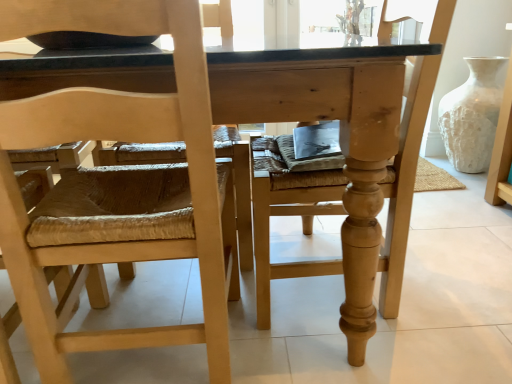
Question: Which direction should I rotate to look at natural wood chair at center, the first chair when ordered from right to left?

Choices:
 (A) right
 (B) left

Answer: (A)

Question: Considering the relative positions of white textured vase at right and natural wood chair at left, placed as the first chair when sorted from left to right, in the image provided, is white textured vase at right in front of natural wood chair at left, placed as the first chair when sorted from left to right,?

Choices:
 (A) no
 (B) yes

Answer: (A)

Question: From the image's perspective, would you say white textured vase at right is shown under natural wood chair at left, placed as the first chair when sorted from left to right?

Choices:
 (A) yes
 (B) no

Answer: (B)

Question: Considering the relative sizes of white textured vase at right and natural wood chair at left, placed as the first chair when sorted from left to right, in the image provided, is white textured vase at right thinner than natural wood chair at left, placed as the first chair when sorted from left to right,?

Choices:
 (A) no
 (B) yes

Answer: (B)

Question: Can you confirm if white textured vase at right is positioned to the right of natural wood chair at left, placed as the first chair when sorted from left to right?

Choices:
 (A) yes
 (B) no

Answer: (A)

Question: Considering the relative positions of white textured vase at right and natural wood chair at left, the second chair viewed from the right, in the image provided, is white textured vase at right behind natural wood chair at left, the second chair viewed from the right,?

Choices:
 (A) yes
 (B) no

Answer: (A)

Question: Are white textured vase at right and natural wood chair at left, placed as the first chair when sorted from left to right, located far from each other?

Choices:
 (A) no
 (B) yes

Answer: (B)

Question: Is white textured vase at right closer to camera compared to natural wood table at center?

Choices:
 (A) no
 (B) yes

Answer: (A)

Question: Can you confirm if white textured vase at right is thinner than natural wood table at center?

Choices:
 (A) yes
 (B) no

Answer: (A)

Question: Is white textured vase at right at the left side of natural wood table at center?

Choices:
 (A) yes
 (B) no

Answer: (B)

Question: Is white textured vase at right surrounding natural wood table at center?

Choices:
 (A) no
 (B) yes

Answer: (A)

Question: Is white textured vase at right next to natural wood table at center and touching it?

Choices:
 (A) yes
 (B) no

Answer: (B)

Question: Does white textured vase at right have a lesser height compared to natural wood table at center?

Choices:
 (A) no
 (B) yes

Answer: (A)

Question: Is natural wood chair at center, the first chair when ordered from right to left, far away from white textured vase at right?

Choices:
 (A) yes
 (B) no

Answer: (A)